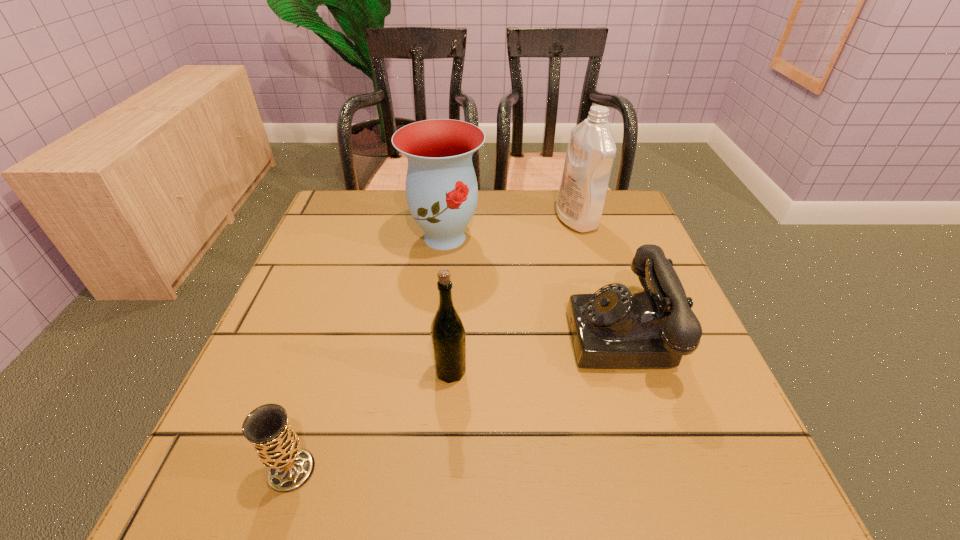
Where is `vacant area that lies between the beer bottle and the detergent`? Image resolution: width=960 pixels, height=540 pixels. vacant area that lies between the beer bottle and the detergent is located at coordinates (514, 295).

Locate an element on the screen. Image resolution: width=960 pixels, height=540 pixels. vacant area that lies between the beer bottle and the detergent is located at coordinates (514, 295).

The height and width of the screenshot is (540, 960). In order to click on blank region between the beer bottle and the telephone in this screenshot , I will do pos(538,352).

The image size is (960, 540). Find the location of `object that ranks as the fourth closest to the nearest object`. object that ranks as the fourth closest to the nearest object is located at coordinates (591, 150).

Identify which object is located as the fourth nearest to the vase. Please provide its 2D coordinates. Your answer should be formatted as a tuple, i.e. [(x, y)], where the tuple contains the x and y coordinates of a point satisfying the conditions above.

[(277, 445)]

Locate an element on the screen. free location that satisfies the following two spatial constraints: 1. on the back side of the detergent; 2. on the left side of the beer bottle is located at coordinates (460, 220).

Identify the location of vacant space that satisfies the following two spatial constraints: 1. on the back side of the chalice; 2. on the left side of the detergent. Image resolution: width=960 pixels, height=540 pixels. (373, 220).